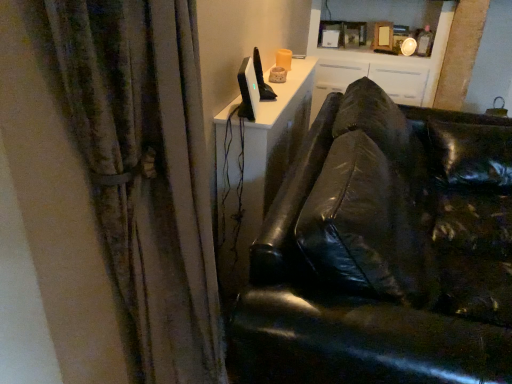
Question: In terms of size, does satin black monitor at upper center appear bigger or smaller than textured fabric curtain at left?

Choices:
 (A) big
 (B) small

Answer: (B)

Question: Is satin black monitor at upper center to the left or to the right of textured fabric curtain at left in the image?

Choices:
 (A) left
 (B) right

Answer: (B)

Question: Which object is the closest to the black leather couch at right?

Choices:
 (A) white glossy cabinet at upper center
 (B) satin black monitor at upper center
 (C) textured fabric curtain at left

Answer: (C)

Question: Based on their relative distances, which object is farther from the textured fabric curtain at left?

Choices:
 (A) satin black monitor at upper center
 (B) white glossy cabinet at upper center
 (C) black leather couch at right

Answer: (B)